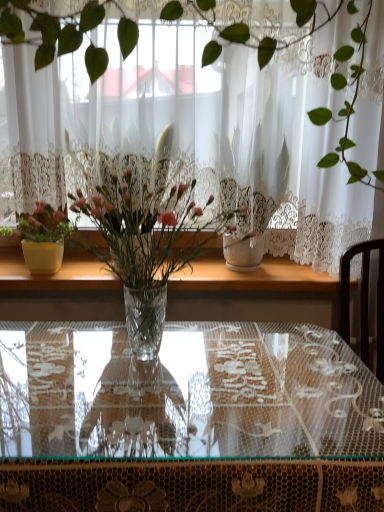
Question: Should I look upward or downward to see clear glass vase at center, which is the 1th houseplant from right to left?

Choices:
 (A) down
 (B) up

Answer: (A)

Question: Is white lace curtain at center aimed at clear wood window sill at center?

Choices:
 (A) no
 (B) yes

Answer: (A)

Question: Is white lace curtain at center located outside clear wood window sill at center?

Choices:
 (A) yes
 (B) no

Answer: (A)

Question: Considering the relative sizes of white lace curtain at center and clear wood window sill at center in the image provided, is white lace curtain at center bigger than clear wood window sill at center?

Choices:
 (A) yes
 (B) no

Answer: (A)

Question: Considering the relative sizes of white lace curtain at center and clear wood window sill at center in the image provided, is white lace curtain at center thinner than clear wood window sill at center?

Choices:
 (A) yes
 (B) no

Answer: (A)

Question: Is white lace curtain at center placed right next to clear wood window sill at center?

Choices:
 (A) no
 (B) yes

Answer: (A)

Question: From the image's perspective, does white lace curtain at center appear higher than clear wood window sill at center?

Choices:
 (A) yes
 (B) no

Answer: (A)

Question: Considering the relative sizes of clear glass vase at center, which is the 2th houseplant in back-to-front order, and transparent glass table at center in the image provided, is clear glass vase at center, which is the 2th houseplant in back-to-front order, wider than transparent glass table at center?

Choices:
 (A) yes
 (B) no

Answer: (B)

Question: From a real-world perspective, is clear glass vase at center, which appears as the first houseplant when viewed from the front, positioned over transparent glass table at center based on gravity?

Choices:
 (A) no
 (B) yes

Answer: (B)

Question: Does clear glass vase at center, positioned as the 2th houseplant in left-to-right order, appear on the right side of transparent glass table at center?

Choices:
 (A) yes
 (B) no

Answer: (B)

Question: Would you say clear glass vase at center, which is the 2th houseplant in back-to-front order, is outside transparent glass table at center?

Choices:
 (A) yes
 (B) no

Answer: (A)

Question: Are clear glass vase at center, which appears as the first houseplant when viewed from the front, and transparent glass table at center located far from each other?

Choices:
 (A) yes
 (B) no

Answer: (B)

Question: Is clear glass vase at center, positioned as the 2th houseplant in left-to-right order, looking in the opposite direction of transparent glass table at center?

Choices:
 (A) no
 (B) yes

Answer: (A)

Question: Considering the relative sizes of matte yellow pot at left, which appears as the 2th houseplant when viewed from the right, and clear glass vase at center, which is the 1th houseplant from right to left, in the image provided, is matte yellow pot at left, which appears as the 2th houseplant when viewed from the right, bigger than clear glass vase at center, which is the 1th houseplant from right to left,?

Choices:
 (A) yes
 (B) no

Answer: (B)